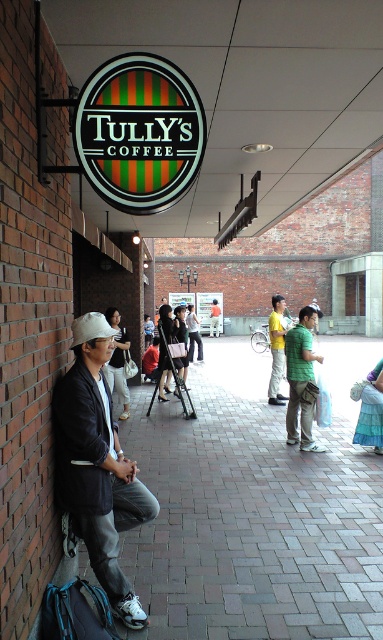
Question: Considering the real-world distances, which object is closest to the dark gray leather jacket at left?

Choices:
 (A) green matte shirt at center
 (B) brick pavement at center
 (C) yellow cotton shirt at center
 (D) orange shirt at center

Answer: (B)

Question: Which object is positioned closest to the green matte shirt at center?

Choices:
 (A) orange shirt at center
 (B) yellow cotton shirt at center
 (C) dark gray leather jacket at left
 (D) brick pavement at center

Answer: (D)

Question: Estimate the real-world distances between objects in this image. Which object is farther from the brick pavement at center?

Choices:
 (A) dark gray leather jacket at left
 (B) green matte shirt at center

Answer: (A)

Question: Can you confirm if dark gray leather jacket at left is bigger than yellow cotton shirt at center?

Choices:
 (A) yes
 (B) no

Answer: (B)

Question: Can you confirm if green matte shirt at center is thinner than yellow cotton shirt at center?

Choices:
 (A) no
 (B) yes

Answer: (A)

Question: Can you confirm if green matte shirt at center is positioned above orange shirt at center?

Choices:
 (A) no
 (B) yes

Answer: (A)